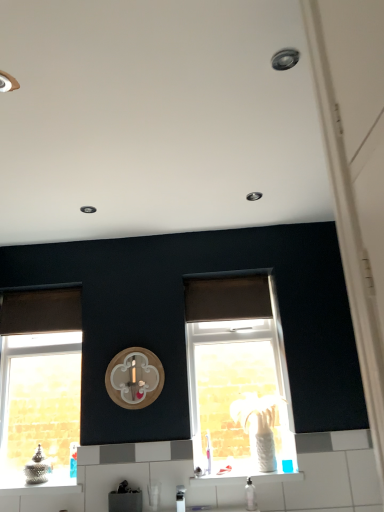
Question: Is brown fabric curtain at left, the second curtain from the right, taller or shorter than white glossy tile at lower center?

Choices:
 (A) short
 (B) tall

Answer: (B)

Question: From a real-world perspective, is brown fabric curtain at left, the second curtain from the right, positioned above or below white glossy tile at lower center?

Choices:
 (A) below
 (B) above

Answer: (B)

Question: Which is nearer to the brown matte curtain at center, the 2th curtain from the left?

Choices:
 (A) brown fabric curtain at left, the first curtain viewed from the left
 (B) translucent glass window at center, acting as the 1th window starting from the right
 (C) wooden clock at center
 (D) white glossy tile at lower center
 (E) satin silver faucet at lower center

Answer: (B)

Question: Which object is the closest to the white glossy tile at lower center?

Choices:
 (A) brown fabric curtain at left, the second curtain from the right
 (B) brown matte curtain at center, the first curtain positioned from the right
 (C) wooden clock at center
 (D) clear glass window at left, the 2th window when ordered from right to left
 (E) satin silver faucet at lower center

Answer: (E)